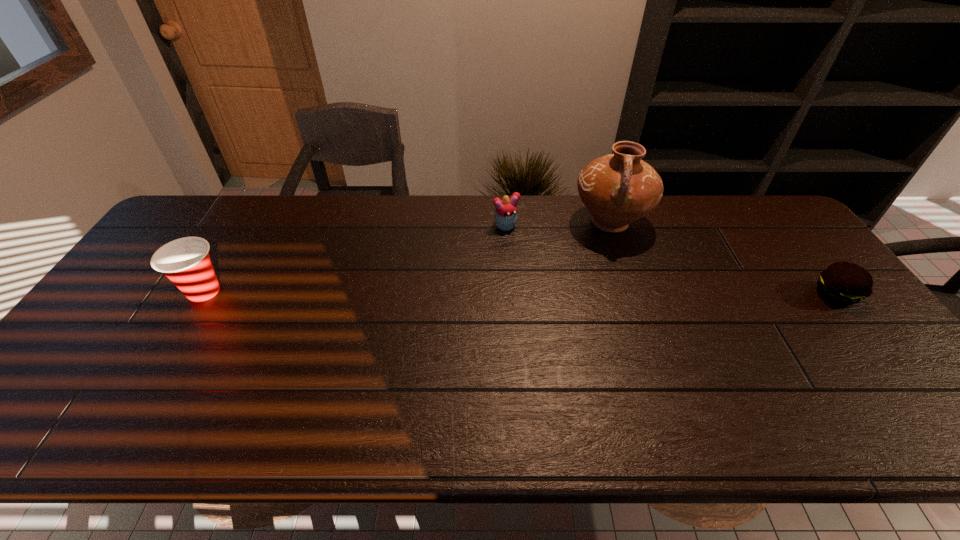
You are a GUI agent. You are given a task and a screenshot of the screen. Output one action in this format:
    pyautogui.click(x=<x>, y=<y>)
    Task: Click on the third shortest object
    The image size is (960, 540).
    Given the screenshot: What is the action you would take?
    pyautogui.click(x=186, y=262)

The image size is (960, 540). I want to click on the leftmost object, so click(x=186, y=262).

Image resolution: width=960 pixels, height=540 pixels. I want to click on the shortest object, so click(x=842, y=283).

This screenshot has width=960, height=540. What are the coordinates of `patty` in the screenshot? It's located at (842, 283).

Locate an element on the screen. the third tallest object is located at coordinates (505, 216).

Image resolution: width=960 pixels, height=540 pixels. What are the coordinates of `cupcake` in the screenshot? It's located at (505, 216).

The height and width of the screenshot is (540, 960). I want to click on the second object from right to left, so pyautogui.click(x=617, y=189).

Identify the location of the tallest object. (617, 189).

This screenshot has height=540, width=960. Identify the location of vacant position located 0.270m on the back of the second tallest object. (249, 217).

Identify the location of free space located on the back of the shortest object. (792, 239).